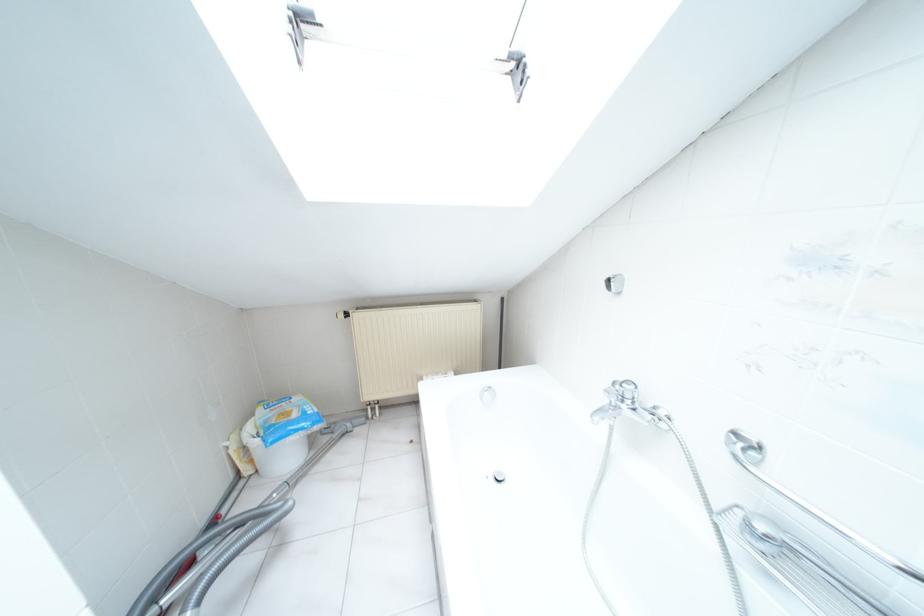
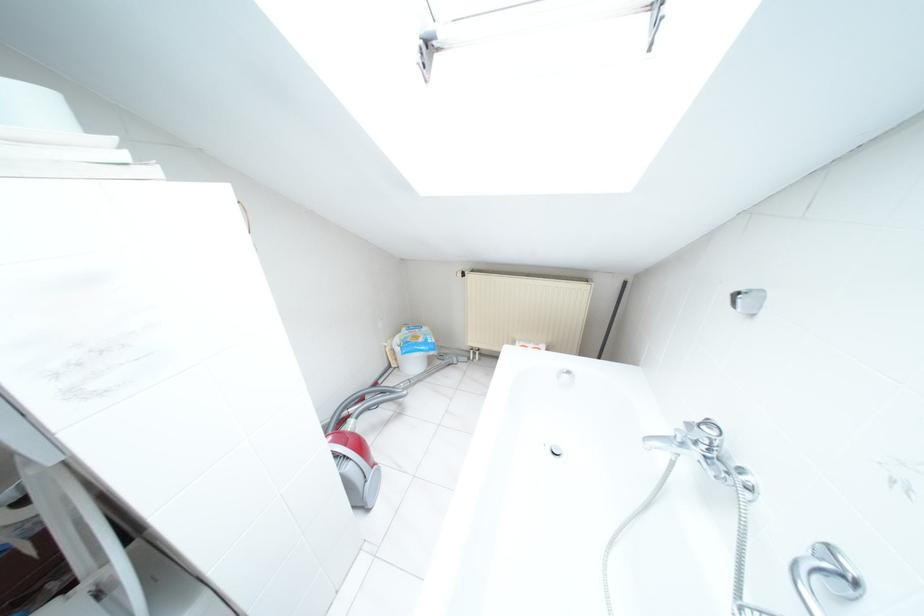
Find the pixel in the second image that matches pixel 299 62 in the first image.

(426, 81)